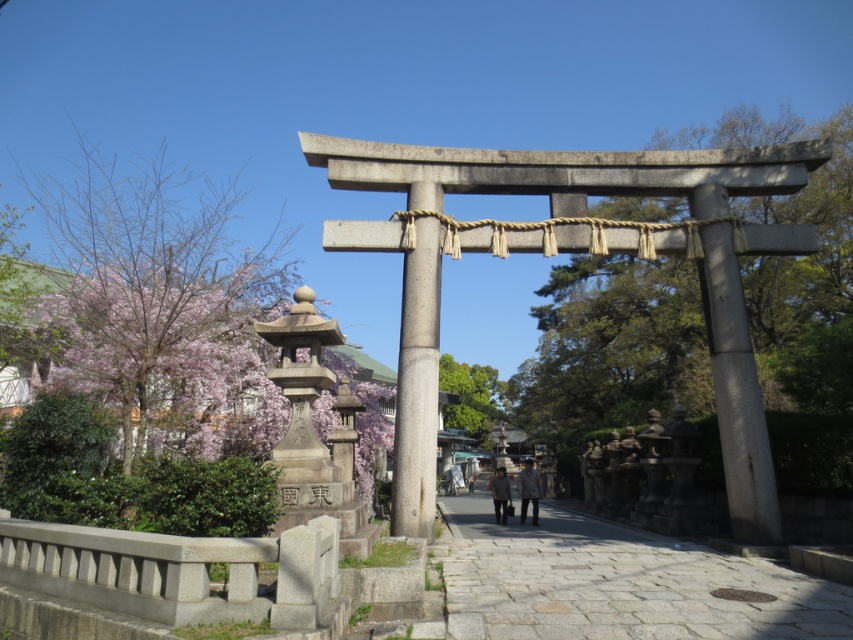
Question: Which point is farther to the camera?

Choices:
 (A) (418, 532)
 (B) (840, 625)

Answer: (A)

Question: Which point appears farthest from the camera in this image?

Choices:
 (A) (759, 406)
 (B) (427, 362)

Answer: (A)

Question: From the image, what is the correct spatial relationship of smooth gray pole at center in relation to gray wool coat at center?

Choices:
 (A) above
 (B) below

Answer: (A)

Question: Does smooth gray stone torii gate at center have a lesser width compared to gray wool coat at center?

Choices:
 (A) yes
 (B) no

Answer: (A)

Question: Which object is positioned closest to the smooth gray stone torii gate at center?

Choices:
 (A) dark gray jacket at center
 (B) gray wool coat at center
 (C) paved stone path at center

Answer: (C)

Question: Does smooth gray pole at center have a greater width compared to dark gray jacket at center?

Choices:
 (A) no
 (B) yes

Answer: (A)